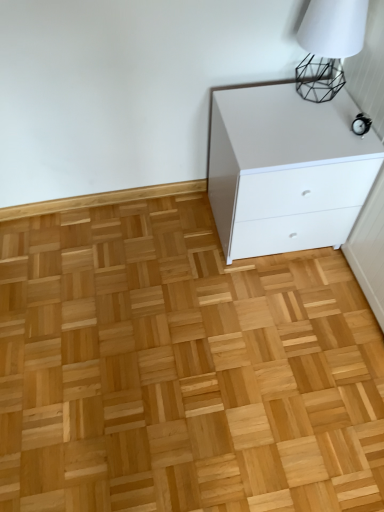
Describe the element at coordinates (181, 369) in the screenshot. I see `natural wood floor at center` at that location.

Measure the distance between point [174,452] and camera.

Point [174,452] and camera are 4.03 feet apart.

In order to click on white matte table lamp at upper right in this screenshot , I will do `click(328, 46)`.

Considering the sizes of white glossy chest of drawers at upper right and natural wood floor at center in the image, is white glossy chest of drawers at upper right bigger or smaller than natural wood floor at center?

Considering their sizes, white glossy chest of drawers at upper right takes up more space than natural wood floor at center.

Consider the image. What's the angular difference between white glossy chest of drawers at upper right and natural wood floor at center's facing directions?

They differ by 89.6 degrees in their facing directions.

Between white glossy chest of drawers at upper right and natural wood floor at center, which one appears on the left side from the viewer's perspective?

From the viewer's perspective, natural wood floor at center appears more on the left side.

From a real-world perspective, who is located lower, white glossy chest of drawers at upper right or natural wood floor at center?

In real-world perspective, natural wood floor at center is lower.

Between white glossy chest of drawers at upper right and white matte table lamp at upper right, which one has larger size?

white glossy chest of drawers at upper right is bigger.

Is white glossy chest of drawers at upper right next to white matte table lamp at upper right?

No, white glossy chest of drawers at upper right is not in contact with white matte table lamp at upper right.

Which is closer, (285,249) or (355,3)?

Point (285,249) is farther from the camera than point (355,3).

In the scene shown: From a real-world perspective, who is located higher, white glossy chest of drawers at upper right or white matte table lamp at upper right?

From a 3D spatial view, white matte table lamp at upper right is above.

Is the depth of natural wood floor at center less than that of white glossy chest of drawers at upper right?

Yes, it is.

Considering the sizes of natural wood floor at center and white glossy chest of drawers at upper right in the image, is natural wood floor at center taller or shorter than white glossy chest of drawers at upper right?

natural wood floor at center is shorter than white glossy chest of drawers at upper right.

This screenshot has height=512, width=384. Find the location of `the chest of drawers behind the natural wood floor at center`. the chest of drawers behind the natural wood floor at center is located at coordinates (286, 170).

From a real-world perspective, is natural wood floor at center beneath white matte table lamp at upper right?

Yes, from a real-world perspective, natural wood floor at center is beneath white matte table lamp at upper right.

Is natural wood floor at center to the left of white matte table lamp at upper right from the viewer's perspective?

Indeed, natural wood floor at center is positioned on the left side of white matte table lamp at upper right.

Is natural wood floor at center not inside white matte table lamp at upper right?

natural wood floor at center is positioned outside white matte table lamp at upper right.

Considering the relative positions of white matte table lamp at upper right and white glossy chest of drawers at upper right in the image provided, is white matte table lamp at upper right behind white glossy chest of drawers at upper right?

No, white matte table lamp at upper right is closer to the viewer.

Would you consider white matte table lamp at upper right to be distant from white glossy chest of drawers at upper right?

No, there isn't a large distance between white matte table lamp at upper right and white glossy chest of drawers at upper right.

Is white matte table lamp at upper right inside or outside of white glossy chest of drawers at upper right?

The correct answer is: outside.

From a real-world perspective, does white matte table lamp at upper right stand above white glossy chest of drawers at upper right?

Correct, in the physical world, white matte table lamp at upper right is higher than white glossy chest of drawers at upper right.

Considering the relative positions of white matte table lamp at upper right and natural wood floor at center in the image provided, is white matte table lamp at upper right to the right of natural wood floor at center from the viewer's perspective?

Yes, white matte table lamp at upper right is to the right of natural wood floor at center.

Are white matte table lamp at upper right and natural wood floor at center making contact?

white matte table lamp at upper right and natural wood floor at center are not in contact.

Does white matte table lamp at upper right have a larger size compared to natural wood floor at center?

No.

Is white matte table lamp at upper right oriented towards natural wood floor at center?

No, white matte table lamp at upper right is not turned towards natural wood floor at center.

Locate an element on the screen. The width and height of the screenshot is (384, 512). hardwood lying in front of the white glossy chest of drawers at upper right is located at coordinates (181, 369).

You are a GUI agent. You are given a task and a screenshot of the screen. Output one action in this format:
    pyautogui.click(x=<x>, y=<y>)
    Task: Click on the table lamp above the white glossy chest of drawers at upper right (from the image's perspective)
    The width and height of the screenshot is (384, 512).
    Given the screenshot: What is the action you would take?
    pyautogui.click(x=328, y=46)

Based on their spatial positions, is natural wood floor at center or white glossy chest of drawers at upper right further from white matte table lamp at upper right?

natural wood floor at center.

Looking at the image, which one is located closer to white matte table lamp at upper right, white glossy chest of drawers at upper right or natural wood floor at center?

white glossy chest of drawers at upper right is closer to white matte table lamp at upper right.

From the image, which object appears to be farther from natural wood floor at center, white matte table lamp at upper right or white glossy chest of drawers at upper right?

white matte table lamp at upper right.

Which object lies further to the anchor point white glossy chest of drawers at upper right, natural wood floor at center or white matte table lamp at upper right?

natural wood floor at center is positioned further to the anchor white glossy chest of drawers at upper right.

Based on their spatial positions, is white matte table lamp at upper right or natural wood floor at center closer to white glossy chest of drawers at upper right?

white matte table lamp at upper right lies closer to white glossy chest of drawers at upper right than the other object.

Looking at the image, which one is located closer to natural wood floor at center, white glossy chest of drawers at upper right or white matte table lamp at upper right?

The object closer to natural wood floor at center is white glossy chest of drawers at upper right.

Where is `chest of drawers between white matte table lamp at upper right and natural wood floor at center in the vertical direction`? The width and height of the screenshot is (384, 512). chest of drawers between white matte table lamp at upper right and natural wood floor at center in the vertical direction is located at coordinates (286, 170).